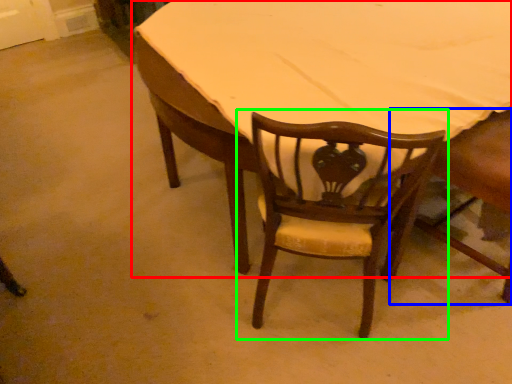
Question: Which is nearer to the table (highlighted by a red box)? chair (highlighted by a blue box) or chair (highlighted by a green box).

Choices:
 (A) chair
 (B) chair

Answer: (B)